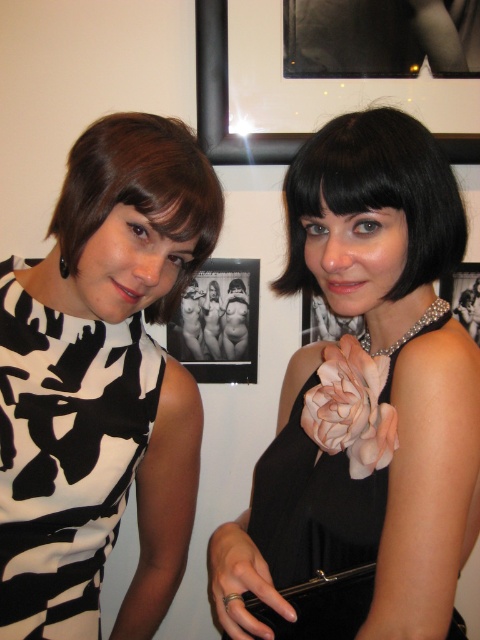
What do you see at coordinates (218, 323) in the screenshot? I see `black matte picture frame at center` at bounding box center [218, 323].

Which is more to the left, black matte picture frame at center or metallic silver frame at upper center?

From the viewer's perspective, black matte picture frame at center appears more on the left side.

This screenshot has width=480, height=640. What do you see at coordinates (218, 323) in the screenshot?
I see `black matte picture frame at center` at bounding box center [218, 323].

Find the location of a particular element. The width and height of the screenshot is (480, 640). black matte picture frame at center is located at coordinates (218, 323).

Is point (132, 451) farther from viewer compared to point (352, 579)?

Yes, point (132, 451) is farther from viewer.

Which is above, black printed fabric dress at left or black satin dress at right?

black printed fabric dress at left is higher up.

Which is behind, point (37, 404) or point (314, 468)?

The point (37, 404) is more distant.

Locate an element on the screen. This screenshot has height=640, width=480. black printed fabric dress at left is located at coordinates (66, 456).

Which of these two, black printed fabric dress at left or black matte picture frame at center, stands taller?

Standing taller between the two is black printed fabric dress at left.

Can you confirm if black printed fabric dress at left is thinner than black matte picture frame at center?

Indeed, black printed fabric dress at left has a lesser width compared to black matte picture frame at center.

Where is `black printed fabric dress at left`? black printed fabric dress at left is located at coordinates (66, 456).